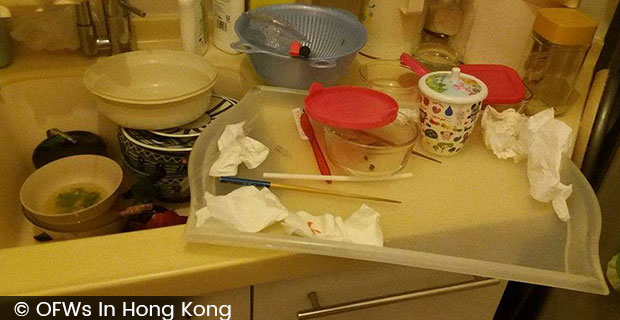
Find the location of `chopstick`. chopstick is located at coordinates (299, 188).